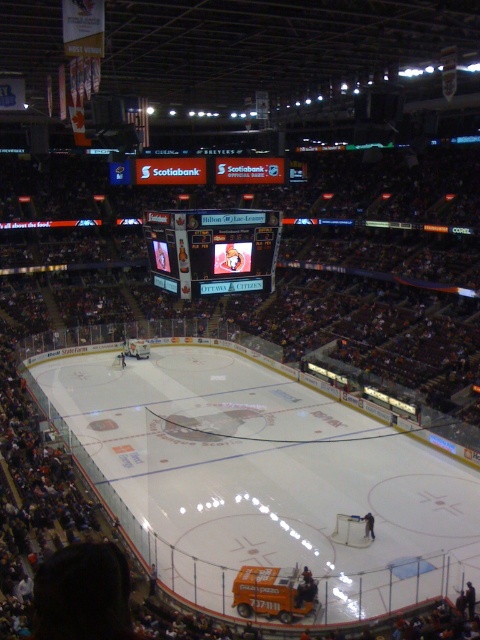
Question: Which of the following is the closest to the observer?

Choices:
 (A) shiny digital display at center
 (B) white smooth ice at center

Answer: (B)

Question: Can you confirm if white smooth ice at center is positioned below shiny digital display at center?

Choices:
 (A) yes
 (B) no

Answer: (A)

Question: Which object appears closest to the camera in this image?

Choices:
 (A) shiny digital display at center
 (B) white smooth ice at center

Answer: (B)

Question: Can you confirm if white smooth ice at center is positioned to the left of shiny digital display at center?

Choices:
 (A) no
 (B) yes

Answer: (B)

Question: Does white smooth ice at center have a lesser width compared to shiny digital display at center?

Choices:
 (A) no
 (B) yes

Answer: (A)